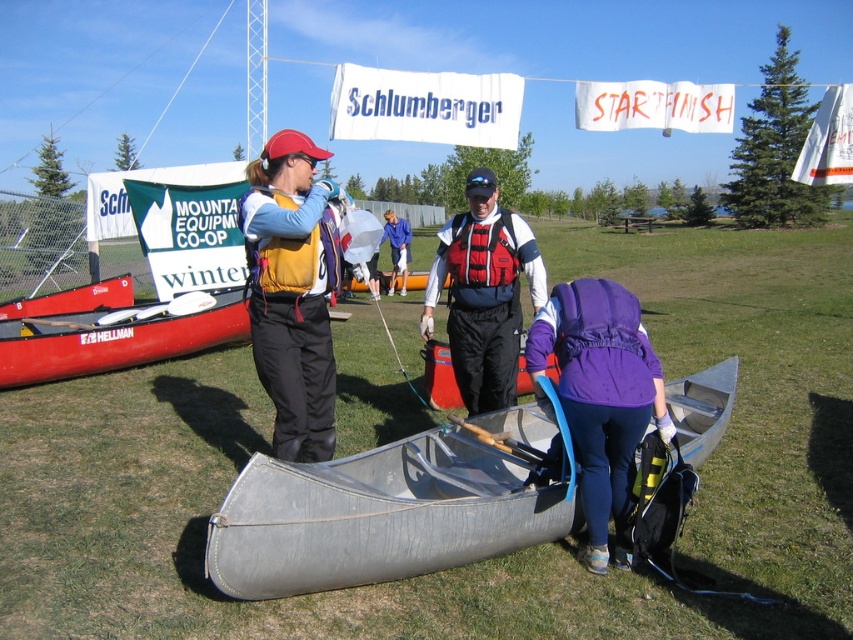
You are standing at point A at point (293, 224) and need to reach point B, which is 3.96 meters away. If you walk at a speed of 1.2 meters per second, how many seconds will it take you to reach point B?

It will take approximately 3.3 seconds to reach point B since 3.96 meters divided by 1.2 meters per second equals 3.3 seconds.

You are organizing a group photo for the canoeing activity. You need to position the red mesh life jacket at center and the blue fabric shirt at center in a straight line from left to right. Based on their current positions, which object should be placed first on the left side of the line?

The blue fabric shirt at center should be placed first on the left side of the line because the red mesh life jacket at center is currently to the right of it.